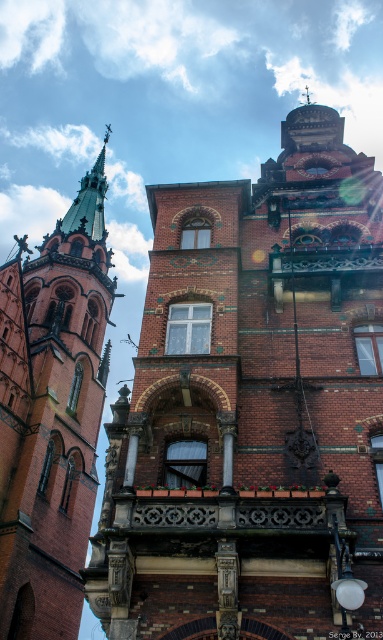
You are an architect analyzing the spatial arrangement of the two brick structures in the image. Which of the two objects, the brick building at center or the brick spire at left, appears lower in the scene?

The brick building at center is located below the brick spire at left, so it appears lower in the scene.

You are a tourist standing in front of the two buildings. You want to take a photo that includes both the brick building at center and the brick spire at left. Which building should you move towards to ensure both are in frame without needing to zoom in or out?

You should move towards the brick spire at left because the brick building at center is closer to the viewer, so moving towards the farther brick spire at left will help keep both in frame without adjusting the zoom.

You are standing at the entrance of the scene and want to locate the brick building at center. According to the coordinates, where exactly is it positioned?

The brick building at center is positioned at the coordinates point (252, 404).